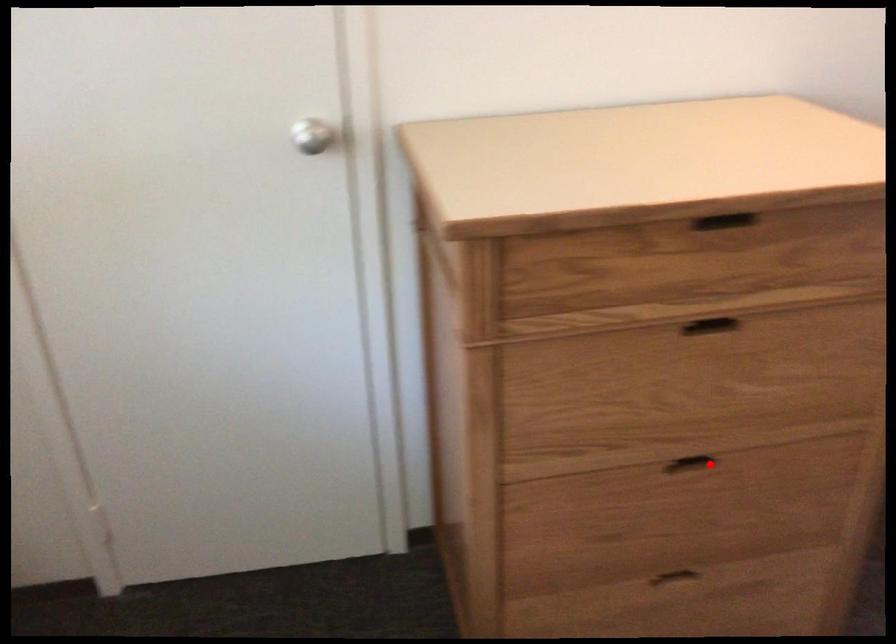
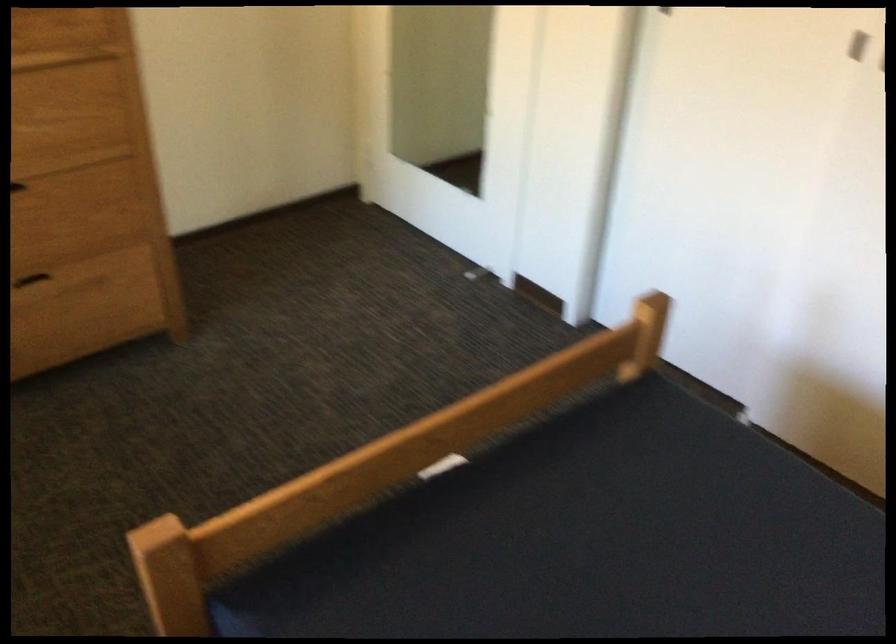
Question: I am providing you with two images of the same scene from different viewpoints. A red point is shown in image1. For the corresponding object point in image2, is it positioned nearer or farther from the camera?

Choices:
 (A) Nearer
 (B) Farther

Answer: (B)